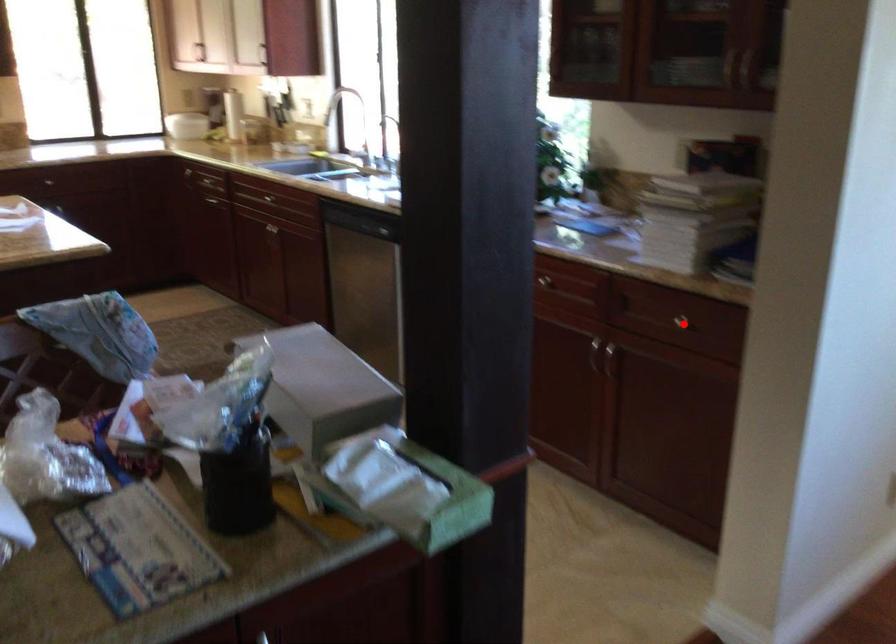
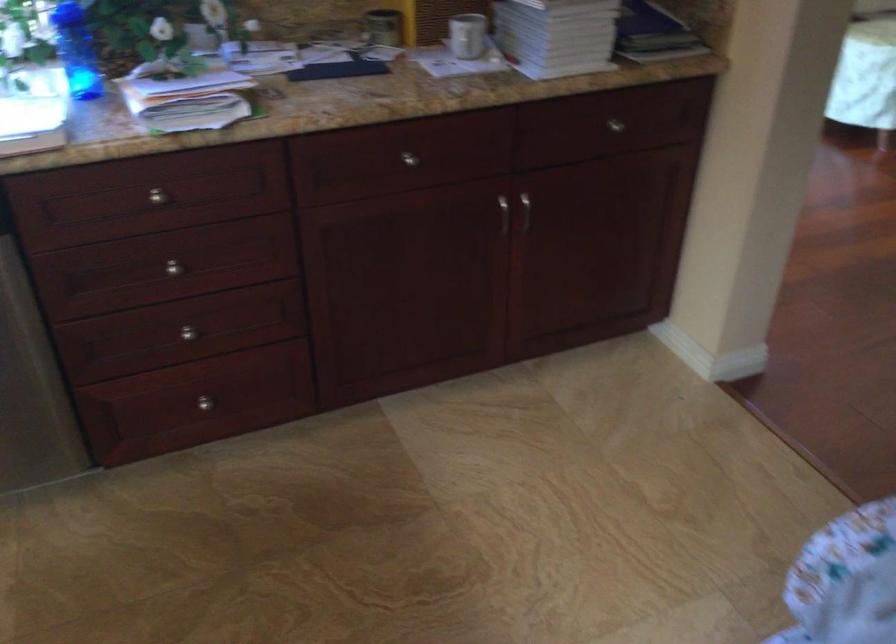
In the second image, find the point that corresponds to the highlighted location in the first image.

(615, 125)